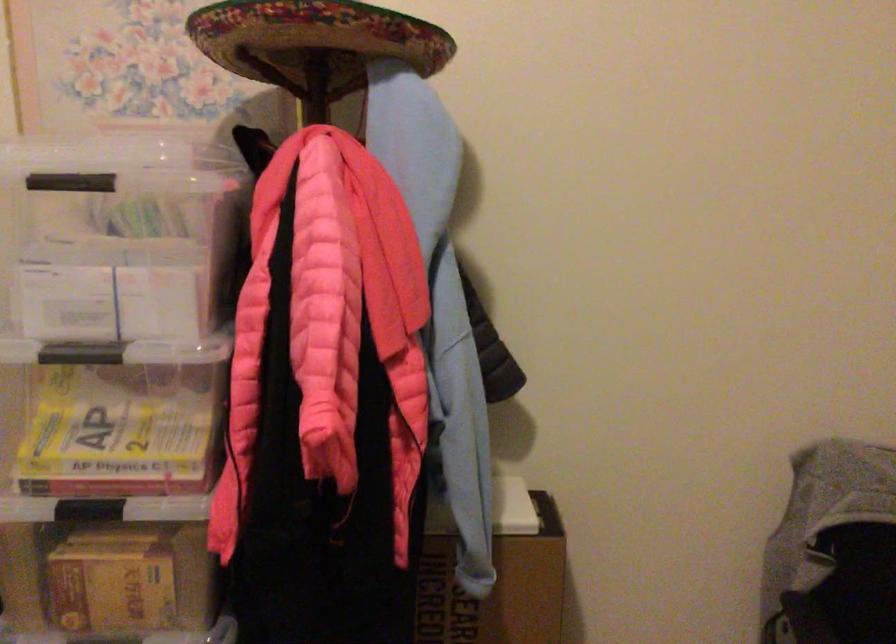
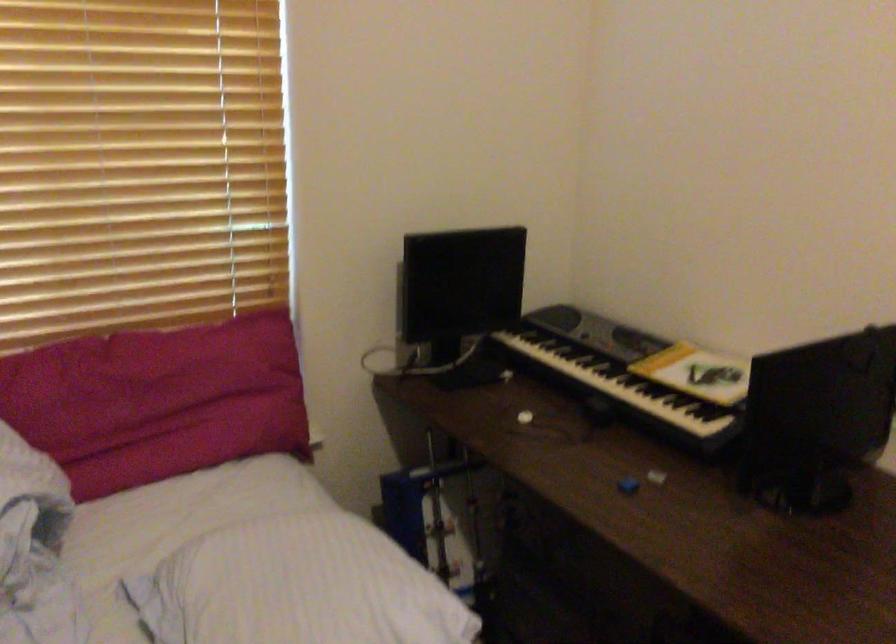
Question: The images are taken continuously from a first-person perspective. In which direction is your viewpoint rotating?

Choices:
 (A) Left
 (B) Right
 (C) Up
 (D) Down

Answer: (A)